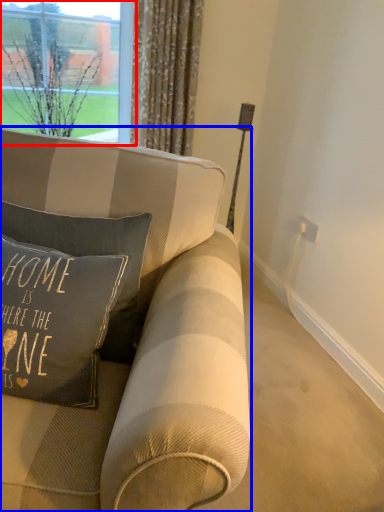
Question: Which of the following is the farthest to the observer, window (highlighted by a red box) or studio couch (highlighted by a blue box)?

Choices:
 (A) window
 (B) studio couch

Answer: (A)